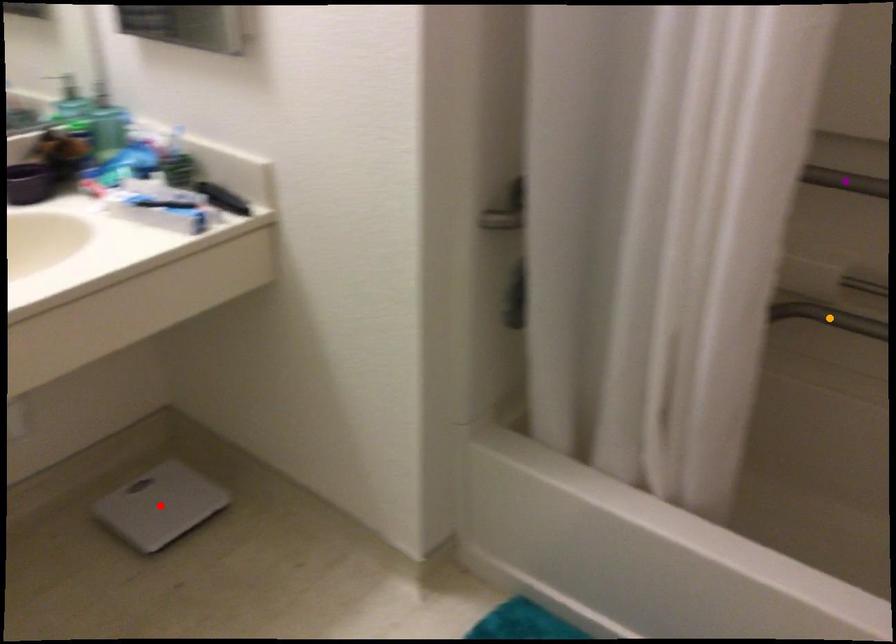
Order these from nearest to farthest:
- orange point
- purple point
- red point

purple point < orange point < red point